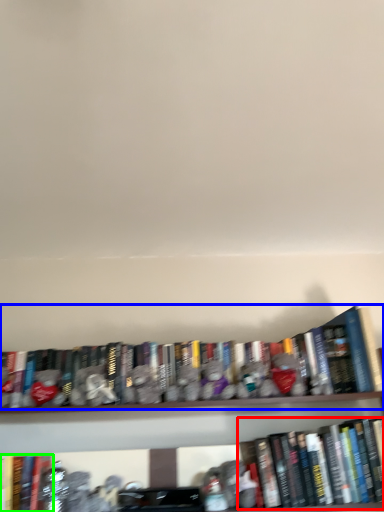
Question: Which is nearer to the book (highlighted by a red box)? book (highlighted by a blue box) or book (highlighted by a green box).

Choices:
 (A) book
 (B) book

Answer: (A)